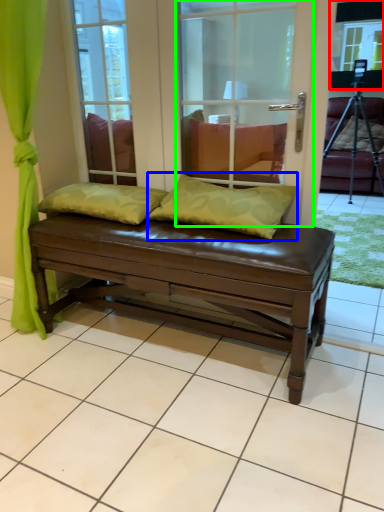
Question: Estimate the real-world distances between objects in this image. Which object is farther from window screen (highlighted by a red box), pillow (highlighted by a blue box) or screen door (highlighted by a green box)?

Choices:
 (A) pillow
 (B) screen door

Answer: (A)